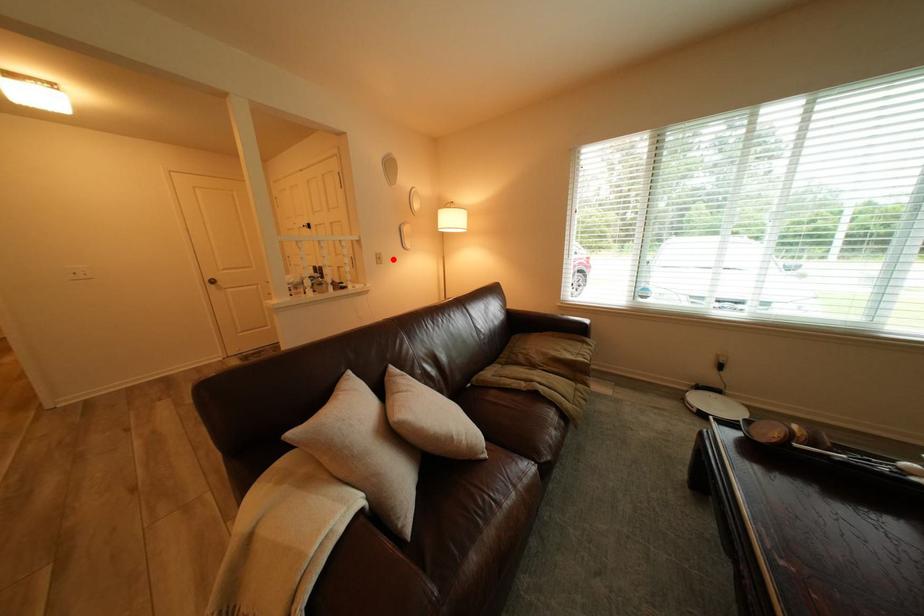
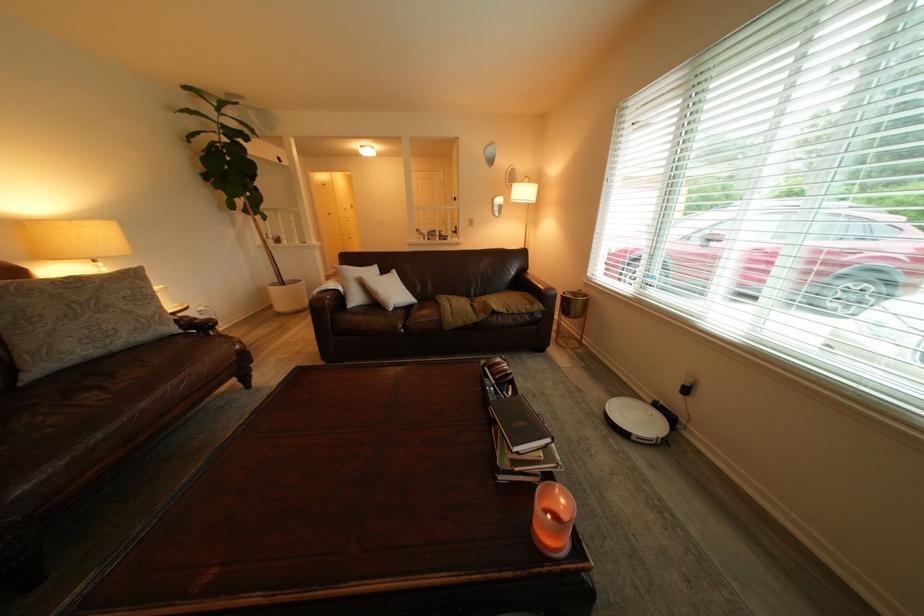
Find the pixel in the second image that matches the highlighted location in the first image.

(484, 223)